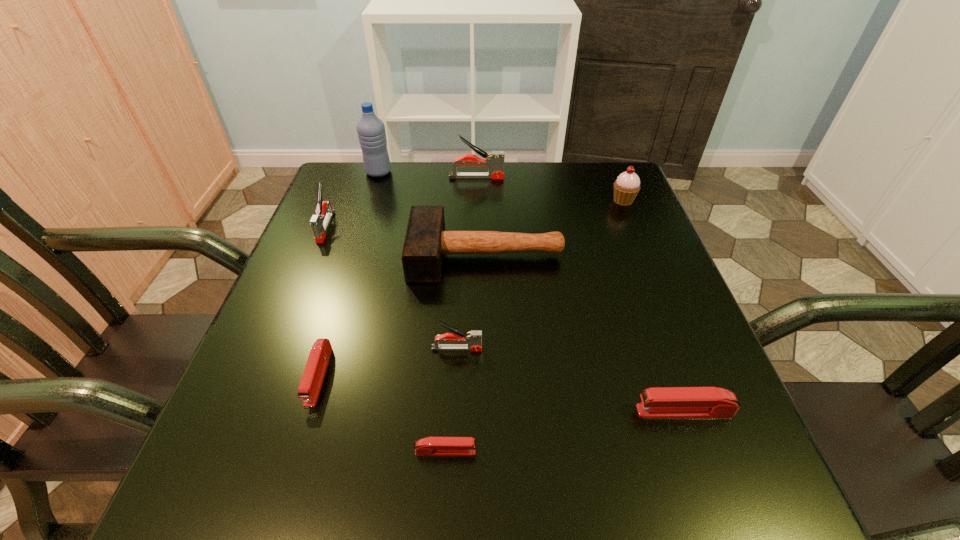
The image size is (960, 540). Identify the location of cupcake present at the far edge. (626, 187).

Identify the location of object that is at the near edge. The width and height of the screenshot is (960, 540). (431, 446).

This screenshot has width=960, height=540. I want to click on water bottle at the left edge, so click(371, 131).

Identify the location of cupcake that is positioned at the right edge. (626, 187).

Where is `stapler situated at the right edge`? The width and height of the screenshot is (960, 540). stapler situated at the right edge is located at coordinates (665, 402).

Find the location of a particular element. object located in the far left corner section of the desktop is located at coordinates (371, 131).

At what (x,y) coordinates should I click in order to perform the action: click on object that is positioned at the far right corner. Please return your answer as a coordinate pair (x, y). This screenshot has width=960, height=540. Looking at the image, I should click on (626, 187).

Image resolution: width=960 pixels, height=540 pixels. In the image, there is a desktop. In order to click on vacant space at the far edge in this screenshot , I will do `click(515, 183)`.

You are a GUI agent. You are given a task and a screenshot of the screen. Output one action in this format:
    pyautogui.click(x=<x>, y=<y>)
    Task: Click on the vacant space at the near edge of the desktop
    
    Given the screenshot: What is the action you would take?
    pyautogui.click(x=437, y=458)

Where is `vacant space at the left edge of the desktop`? This screenshot has height=540, width=960. vacant space at the left edge of the desktop is located at coordinates (308, 354).